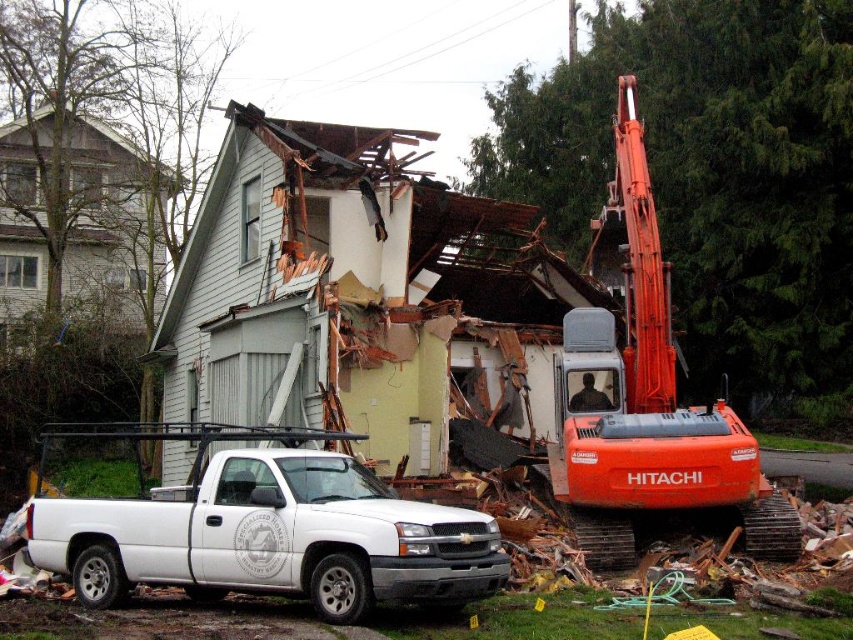
Question: Is white matte truck at lower left thinner than orange metallic excavator at center?

Choices:
 (A) yes
 (B) no

Answer: (B)

Question: Is white matte truck at lower left below orange metallic excavator at center?

Choices:
 (A) yes
 (B) no

Answer: (A)

Question: Which point appears closest to the camera in this image?

Choices:
 (A) (390, 545)
 (B) (585, 387)

Answer: (A)

Question: Which point appears closest to the camera in this image?

Choices:
 (A) (260, 522)
 (B) (590, 243)

Answer: (A)

Question: Observing the image, what is the correct spatial positioning of white matte truck at lower left in reference to orange metallic excavator at center?

Choices:
 (A) left
 (B) right

Answer: (A)